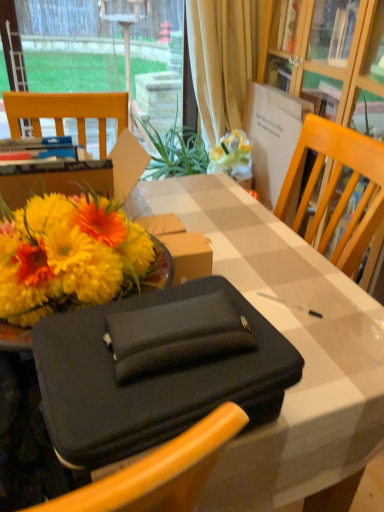
What do you see at coordinates (292, 343) in the screenshot? I see `black fabric briefcase at center` at bounding box center [292, 343].

What do you see at coordinates (67, 47) in the screenshot?
I see `transparent glass window at upper left` at bounding box center [67, 47].

Find the location of `black fabric briefcase at center`. black fabric briefcase at center is located at coordinates (292, 343).

Considering the relative positions of black fabric briefcase at center and transparent glass window at upper left in the image provided, is black fabric briefcase at center to the right of transparent glass window at upper left from the viewer's perspective?

Yes, black fabric briefcase at center is to the right of transparent glass window at upper left.

Between black fabric briefcase at center and transparent glass window at upper left, which one has larger width?

With larger width is black fabric briefcase at center.

Considering the relative sizes of transparent glass window at upper left and beige fabric curtain at upper center in the image provided, is transparent glass window at upper left thinner than beige fabric curtain at upper center?

Yes.

From the image's perspective, relative to beige fabric curtain at upper center, is transparent glass window at upper left above or below?

From the image's perspective, transparent glass window at upper left appears below beige fabric curtain at upper center.

Is beige fabric curtain at upper center a part of transparent glass window at upper left?

No, beige fabric curtain at upper center is not inside transparent glass window at upper left.

Can you tell me how much transparent glass window at upper left and beige fabric curtain at upper center differ in facing direction?

The angular difference between transparent glass window at upper left and beige fabric curtain at upper center is 2.76 degrees.

Based on the photo, is beige fabric curtain at upper center at the left side of black fabric briefcase at center?

No.

Considering the relative sizes of beige fabric curtain at upper center and black fabric briefcase at center in the image provided, is beige fabric curtain at upper center smaller than black fabric briefcase at center?

Correct, beige fabric curtain at upper center occupies less space than black fabric briefcase at center.

Identify the location of desk on the left of beige fabric curtain at upper center. Image resolution: width=384 pixels, height=512 pixels. (292, 343).

Is beige fabric curtain at upper center taller than black fabric briefcase at center?

Indeed, beige fabric curtain at upper center has a greater height compared to black fabric briefcase at center.

Considering the sizes of objects beige fabric curtain at upper center and transparent glass window at upper left in the image provided, who is taller, beige fabric curtain at upper center or transparent glass window at upper left?

transparent glass window at upper left.

Is beige fabric curtain at upper center bigger or smaller than transparent glass window at upper left?

Considering their sizes, beige fabric curtain at upper center takes up less space than transparent glass window at upper left.

Does beige fabric curtain at upper center turn towards transparent glass window at upper left?

No.

Is beige fabric curtain at upper center at the right side of transparent glass window at upper left?

Indeed, beige fabric curtain at upper center is positioned on the right side of transparent glass window at upper left.

From a real-world perspective, between black fabric briefcase at center and beige fabric curtain at upper center, who is vertically lower?

From a 3D spatial view, black fabric briefcase at center is below.

Are black fabric briefcase at center and beige fabric curtain at upper center far apart?

Yes, black fabric briefcase at center and beige fabric curtain at upper center are located far from each other.

Which is more to the right, black fabric briefcase at center or beige fabric curtain at upper center?

Positioned to the right is beige fabric curtain at upper center.

In the scene shown: Is the position of black fabric briefcase at center more distant than that of beige fabric curtain at upper center?

No, the depth of black fabric briefcase at center is less than that of beige fabric curtain at upper center.

Is transparent glass window at upper left positioned with its back to black fabric briefcase at center?

No, black fabric briefcase at center is not at the back of transparent glass window at upper left.

Which of these two, transparent glass window at upper left or black fabric briefcase at center, stands shorter?

black fabric briefcase at center is shorter.

Can you confirm if transparent glass window at upper left is positioned to the left of black fabric briefcase at center?

Indeed, transparent glass window at upper left is positioned on the left side of black fabric briefcase at center.

What's the angular difference between transparent glass window at upper left and black fabric briefcase at center's facing directions?

The angle between the facing direction of transparent glass window at upper left and the facing direction of black fabric briefcase at center is 179 degrees.

Locate an element on the screen. The width and height of the screenshot is (384, 512). desk located below the transparent glass window at upper left (from the image's perspective) is located at coordinates (292, 343).

Locate an element on the screen. window in front of the beige fabric curtain at upper center is located at coordinates (67, 47).

When comparing their distances from transparent glass window at upper left, does black fabric briefcase at center or beige fabric curtain at upper center seem closer?

The object closer to transparent glass window at upper left is beige fabric curtain at upper center.

Looking at the image, which one is located closer to beige fabric curtain at upper center, transparent glass window at upper left or black fabric briefcase at center?

The object closer to beige fabric curtain at upper center is transparent glass window at upper left.

Based on the photo, estimate the real-world distances between objects in this image. Which object is further from black fabric briefcase at center, beige fabric curtain at upper center or transparent glass window at upper left?

transparent glass window at upper left is positioned further to the anchor black fabric briefcase at center.

From the image, which object appears to be nearer to transparent glass window at upper left, beige fabric curtain at upper center or black fabric briefcase at center?

beige fabric curtain at upper center is closer to transparent glass window at upper left.

Estimate the real-world distances between objects in this image. Which object is closer to beige fabric curtain at upper center, black fabric briefcase at center or transparent glass window at upper left?

transparent glass window at upper left.

Considering their positions, is transparent glass window at upper left positioned further to black fabric briefcase at center than beige fabric curtain at upper center?

The object further to black fabric briefcase at center is transparent glass window at upper left.

Where is `window positioned between black fabric briefcase at center and beige fabric curtain at upper center from near to far`? window positioned between black fabric briefcase at center and beige fabric curtain at upper center from near to far is located at coordinates (67, 47).